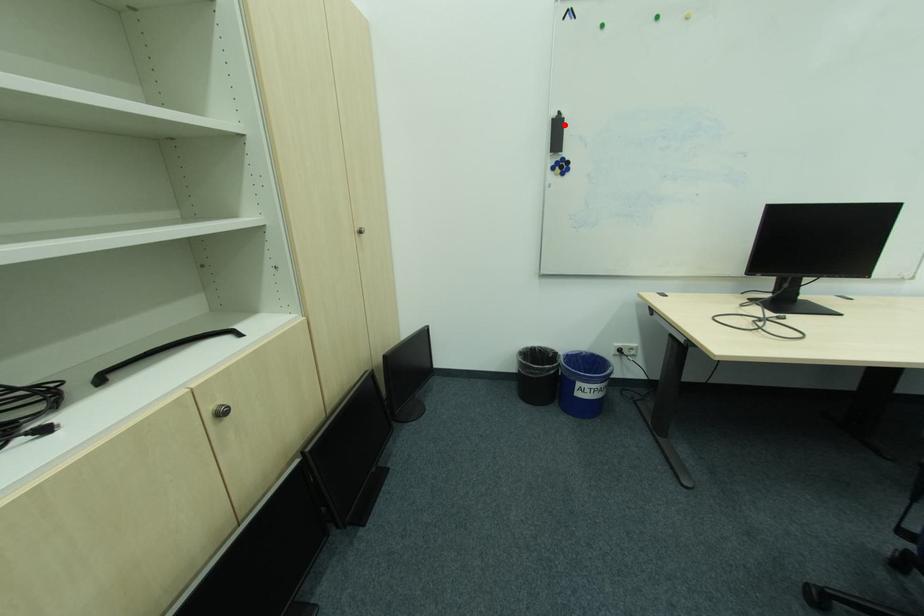
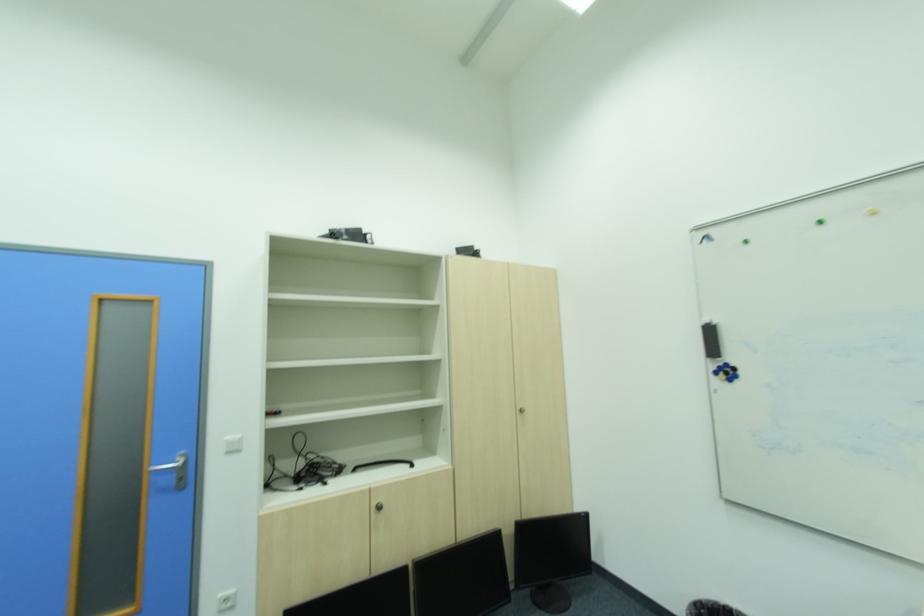
Where in the second image is the point corresponding to the highlighted location from the first image?

(716, 331)